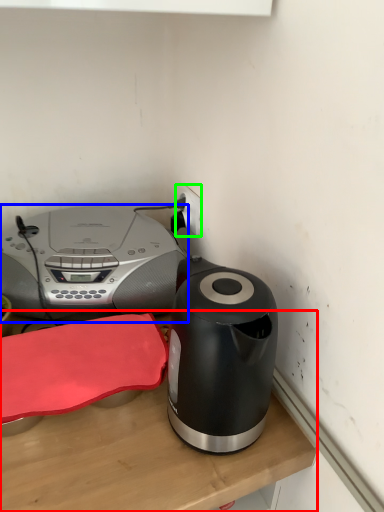
Question: Which object is positioned farthest from table (highlighted by a red box)? Select from home appliance (highlighted by a blue box) and electric outlet (highlighted by a green box).

Choices:
 (A) home appliance
 (B) electric outlet

Answer: (B)